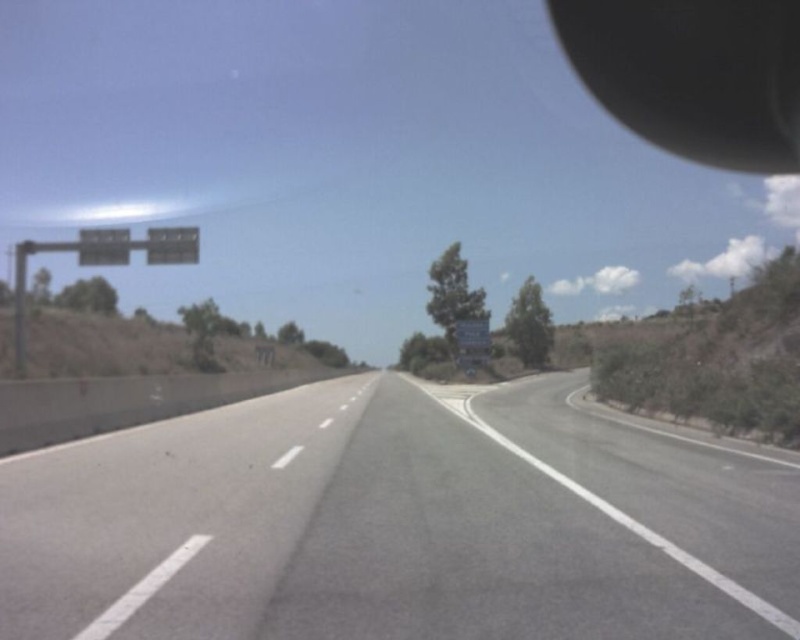
You are driving a car and see the highway ahead. There is a point at coordinates (694, 74). What object is this point located on?

The point at coordinates (694, 74) is located on the black matte view mirror at upper right.

In the scene shown: You are a delivery driver who needs to stay on the gray asphalt highway at center. Your GPS shows a point at coordinates (400, 522). Where should you drive to stay on the highway?

The point at coordinates (400, 522) indicates the gray asphalt highway at center, so you should drive towards that point to stay on the highway.

You are standing on the highway and see a point marked at coordinates (x=568, y=17). If you need to reach a point that is exactly 100 meters away from your current position, is the marked point within your target distance?

The point at coordinates (x=568, y=17) is 87.55 meters away from the viewer, which is less than 100 meters. Therefore, it is not within the target distance of exactly 100 meters.